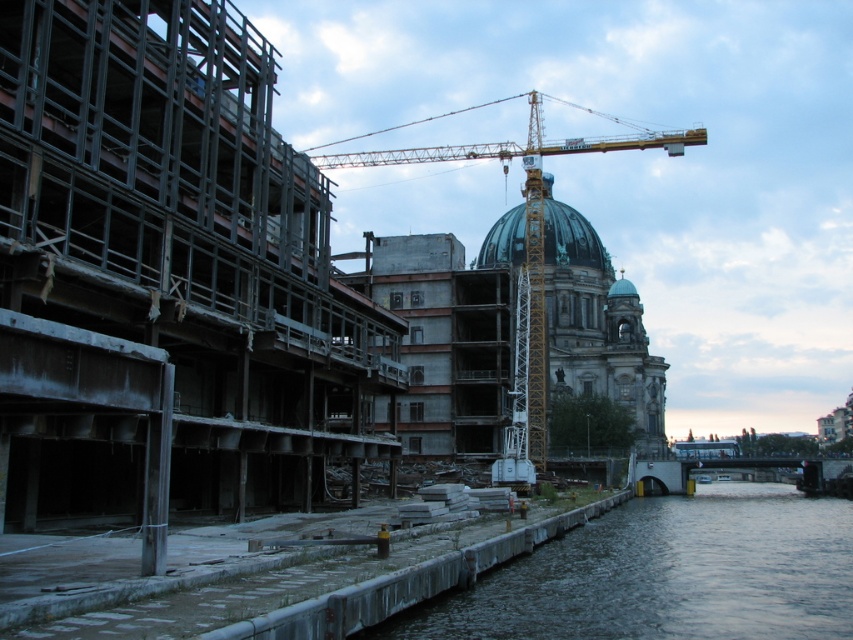
You are an architect observing the construction site. You need to determine if the yellow metallic crane at center can lower materials to the green glass dome at center without obstruction. Based on their positions, what do you conclude?

The yellow metallic crane at center is above the green glass dome at center, so it can lower materials directly onto the green glass dome at center without obstruction.

You are a construction worker standing at the point marked by the coordinates point (527, 218). You need to move towards the historic building with a dome on the right side. Is the yellow metallic crane at center blocking your path?

The point (527, 218) indicates the yellow metallic crane at center. Since you are standing at the crane, it would block your path to the historic building with a dome on the right side.

You are standing in the middle of the scene and want to place a flag at the closest point between point [689,625] and point [503,227]. Which point should you choose?

Point [689,625] is closer to the viewer than point [503,227], so you should place the flag at point [689,625].